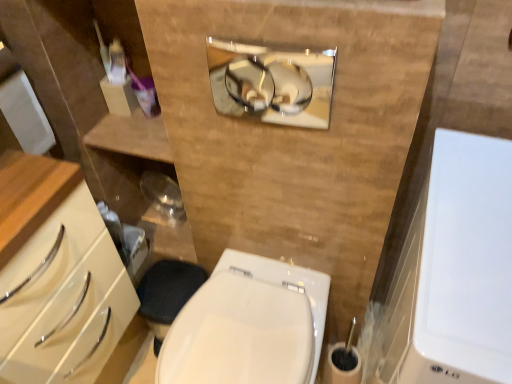
Question: From the image's perspective, is white glossy medicine cabinet at right, arranged as the first medicine cabinet when viewed from the front, under polished chrome mirror at upper center, the 1th medicine cabinet positioned from the top?

Choices:
 (A) no
 (B) yes

Answer: (B)

Question: From a real-world perspective, is white glossy medicine cabinet at right, arranged as the first medicine cabinet when ordered from the bottom, positioned over polished chrome mirror at upper center, the 1th medicine cabinet positioned from the top, based on gravity?

Choices:
 (A) no
 (B) yes

Answer: (A)

Question: Is white glossy medicine cabinet at right, the second medicine cabinet viewed from the left, oriented away from polished chrome mirror at upper center, which is counted as the second medicine cabinet, starting from the bottom?

Choices:
 (A) yes
 (B) no

Answer: (B)

Question: Does white glossy medicine cabinet at right, marked as the 2th medicine cabinet in a top-to-bottom arrangement, have a greater width compared to polished chrome mirror at upper center, which is counted as the second medicine cabinet, starting from the bottom?

Choices:
 (A) no
 (B) yes

Answer: (B)

Question: Is white glossy medicine cabinet at right, arranged as the first medicine cabinet when ordered from the bottom, next to polished chrome mirror at upper center, which is the 2th medicine cabinet in front-to-back order, and touching it?

Choices:
 (A) yes
 (B) no

Answer: (B)

Question: Is point (249, 62) positioned closer to the camera than point (507, 152)?

Choices:
 (A) closer
 (B) farther

Answer: (B)

Question: Considering their positions, is polished chrome mirror at upper center, which is counted as the second medicine cabinet, starting from the bottom, located in front of or behind white glossy medicine cabinet at right, arranged as the first medicine cabinet when ordered from the bottom?

Choices:
 (A) behind
 (B) front

Answer: (A)

Question: Considering the relative positions of polished chrome mirror at upper center, the first medicine cabinet viewed from the left, and white glossy medicine cabinet at right, the 2th medicine cabinet when ordered from back to front, in the image provided, is polished chrome mirror at upper center, the first medicine cabinet viewed from the left, to the left or to the right of white glossy medicine cabinet at right, the 2th medicine cabinet when ordered from back to front,?

Choices:
 (A) right
 (B) left

Answer: (B)

Question: From a real-world perspective, is polished chrome mirror at upper center, the first medicine cabinet viewed from the left, positioned above or below white glossy medicine cabinet at right, marked as the 2th medicine cabinet in a top-to-bottom arrangement?

Choices:
 (A) below
 (B) above

Answer: (B)

Question: From the image's perspective, relative to white glossy bidet at center, is white glossy medicine cabinet at right, which is counted as the 1th medicine cabinet, starting from the right, above or below?

Choices:
 (A) below
 (B) above

Answer: (B)

Question: Looking at their shapes, would you say white glossy medicine cabinet at right, the 2th medicine cabinet when ordered from back to front, is wider or thinner than white glossy bidet at center?

Choices:
 (A) wide
 (B) thin

Answer: (A)

Question: Considering the positions of point (486, 271) and point (234, 344), is point (486, 271) closer or farther from the camera than point (234, 344)?

Choices:
 (A) closer
 (B) farther

Answer: (A)

Question: Is white glossy medicine cabinet at right, the second medicine cabinet viewed from the left, spatially inside white glossy bidet at center, or outside of it?

Choices:
 (A) inside
 (B) outside

Answer: (B)

Question: From a real-world perspective, relative to white glossy medicine cabinet at right, which is counted as the 1th medicine cabinet, starting from the right, is white glossy bidet at center vertically above or below?

Choices:
 (A) above
 (B) below

Answer: (B)

Question: Does point (265, 357) appear closer or farther from the camera than point (435, 175)?

Choices:
 (A) closer
 (B) farther

Answer: (B)